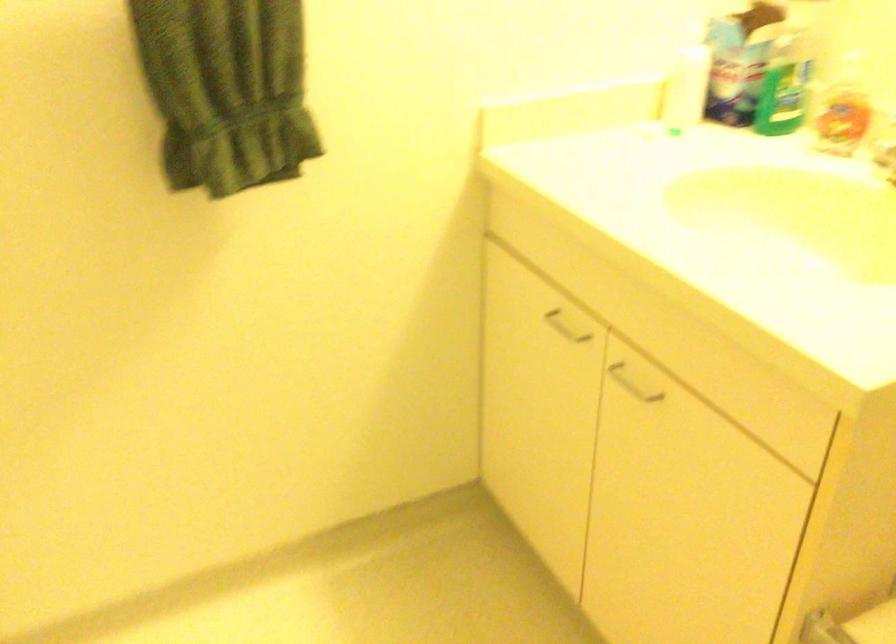
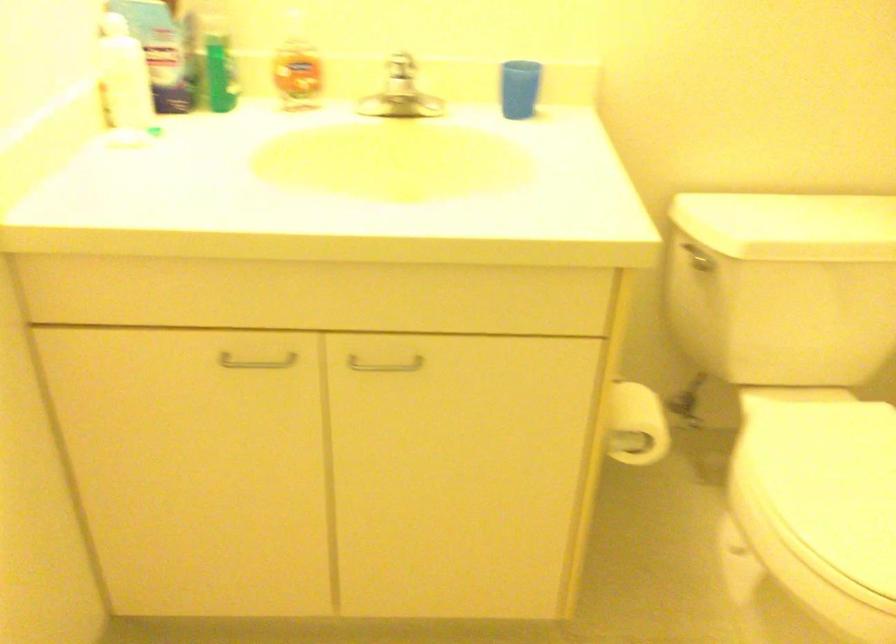
The point at (642, 388) is marked in the first image. Where is the corresponding point in the second image?

(384, 365)